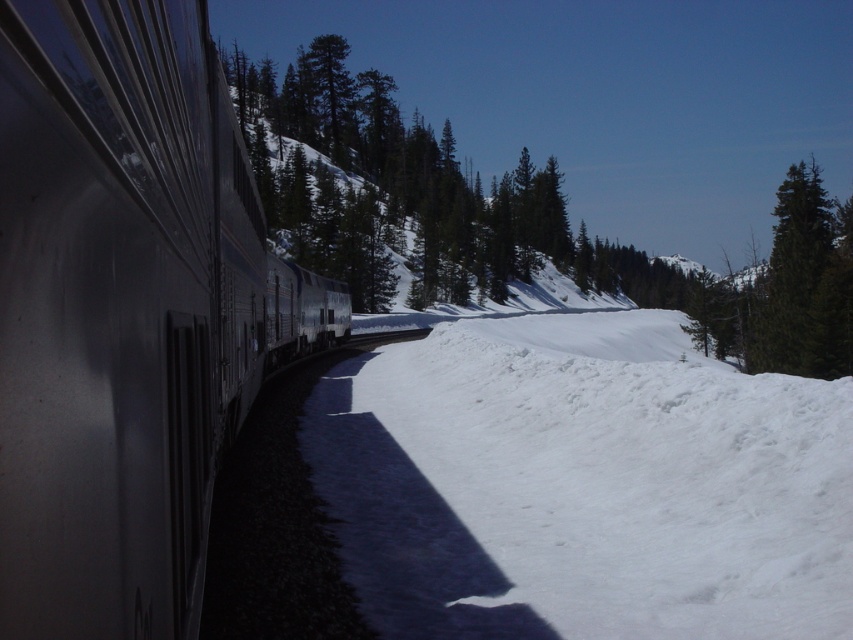
Question: Does white fluffy snow at lower right have a larger size compared to metallic silver train at left?

Choices:
 (A) no
 (B) yes

Answer: (B)

Question: Estimate the real-world distances between objects in this image. Which object is farther from the white fluffy snow at lower right?

Choices:
 (A) metallic silver train at left
 (B) green matte tree at upper right

Answer: (B)

Question: Can you confirm if white fluffy snow at lower right is bigger than green matte tree at upper right?

Choices:
 (A) yes
 (B) no

Answer: (B)

Question: Considering the relative positions of white fluffy snow at lower right and metallic silver train at left in the image provided, where is white fluffy snow at lower right located with respect to metallic silver train at left?

Choices:
 (A) below
 (B) above

Answer: (A)

Question: Which point is closer to the camera?

Choices:
 (A) (554, 348)
 (B) (113, 88)
 (C) (769, 323)

Answer: (B)

Question: Among these objects, which one is nearest to the camera?

Choices:
 (A) metallic silver train at left
 (B) green matte tree at upper right

Answer: (A)